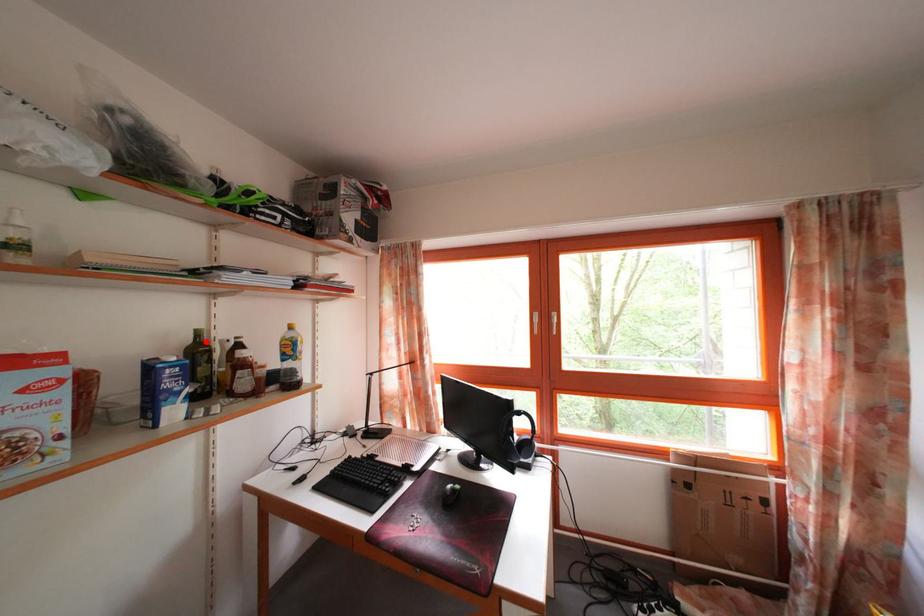
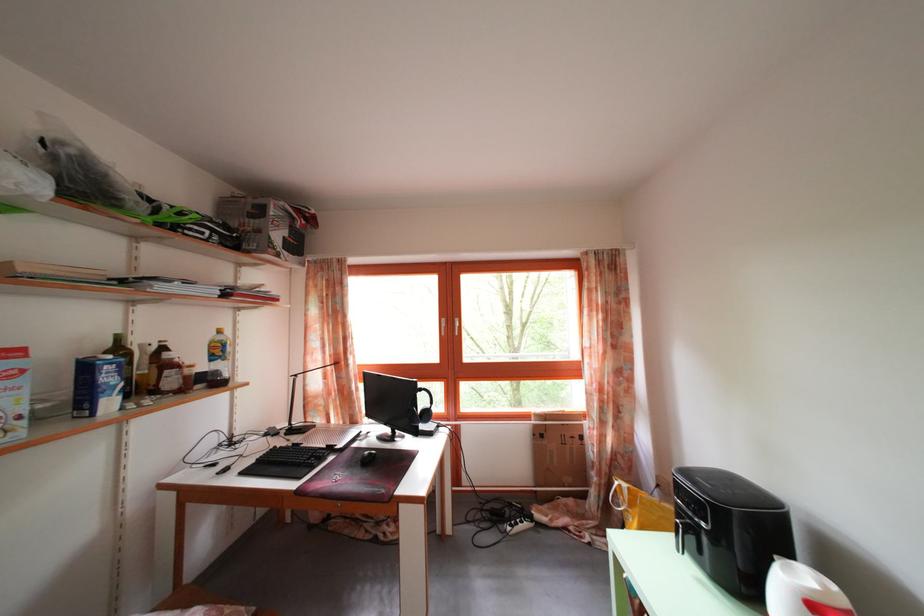
Question: I am providing you with two images of the same scene from different viewpoints. A red point is marked on the first image. Can you still see the location of the red point in image 2?

Choices:
 (A) Yes
 (B) No

Answer: (A)